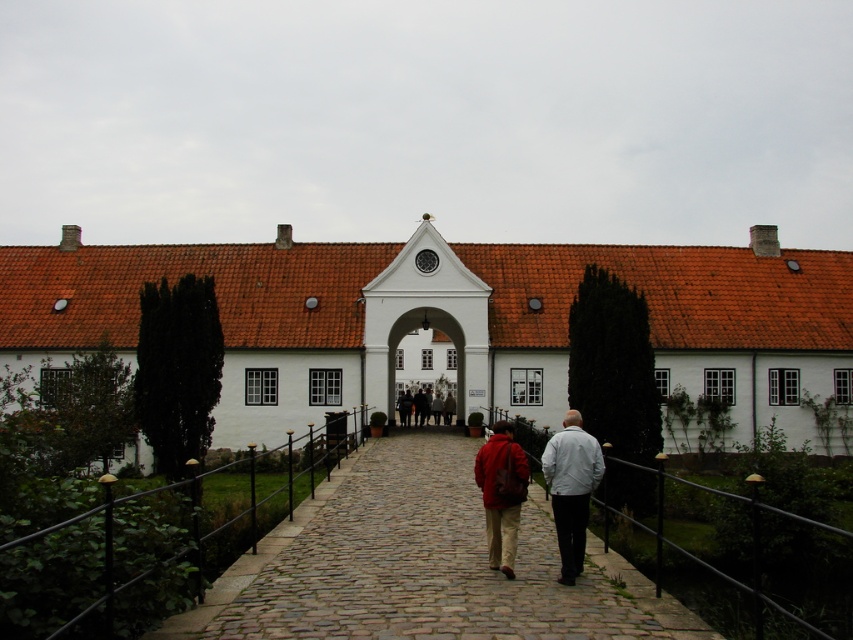
You are standing at the entrance of the white smooth building at center and want to walk to the cobblestone path at center. In which direction should you move relative to the building?

You should move to the left relative to the white smooth building at center because the cobblestone path at center is to the left of the building.

You are standing on the cobblestone pathway in front of the white smooth building at center. You see a dark red leather jacket at center. Which object is closer to you?

The white smooth building at center is closer to the viewer than the dark red leather jacket at center.